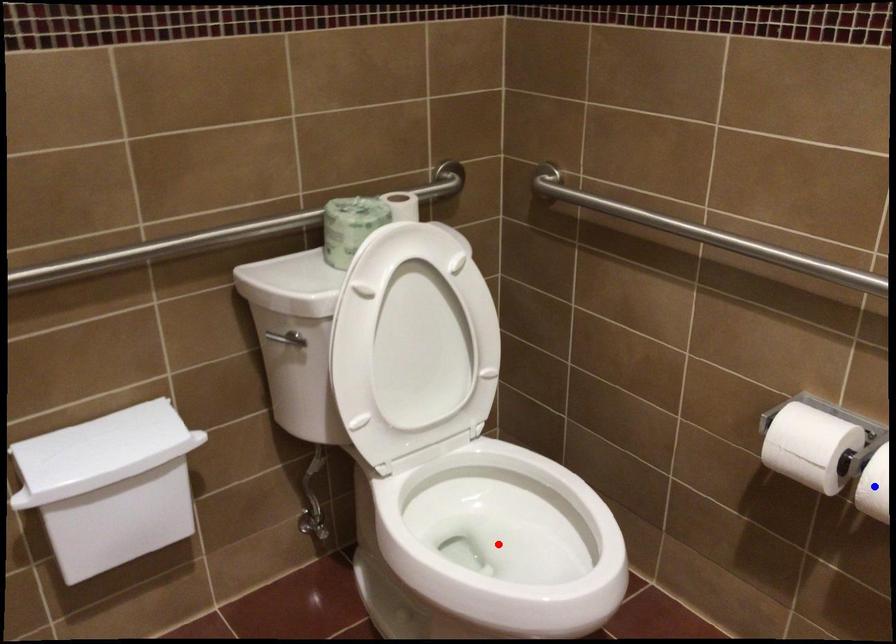
Question: Two points are marked on the image. Which point is closer to the camera?

Choices:
 (A) Blue point is closer.
 (B) Red point is closer.

Answer: (A)